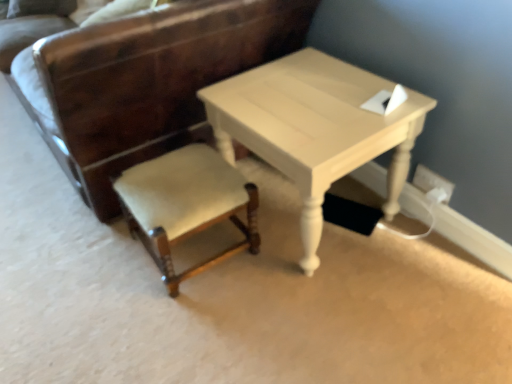
Identify the location of vacant region below light beige wood table at center (from a real-world perspective). pyautogui.click(x=324, y=221).